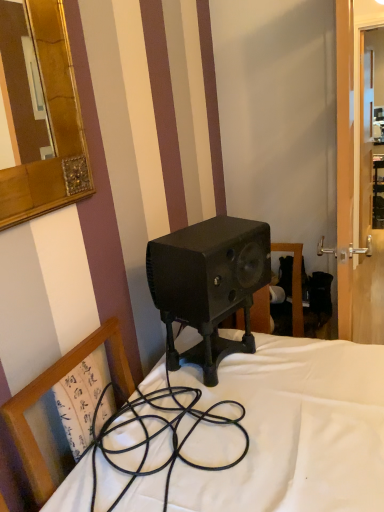
Question: Does matte black speaker at center come behind transparent glass door at right?

Choices:
 (A) yes
 (B) no

Answer: (B)

Question: Is matte black speaker at center positioned in front of transparent glass door at right?

Choices:
 (A) no
 (B) yes

Answer: (B)

Question: Can you confirm if matte black speaker at center is smaller than transparent glass door at right?

Choices:
 (A) yes
 (B) no

Answer: (A)

Question: Is matte black speaker at center next to transparent glass door at right?

Choices:
 (A) yes
 (B) no

Answer: (B)

Question: Can you confirm if matte black speaker at center is positioned to the right of transparent glass door at right?

Choices:
 (A) no
 (B) yes

Answer: (A)

Question: Is wooden chair at center in front of or behind matte black speaker at center in the image?

Choices:
 (A) front
 (B) behind

Answer: (A)

Question: Considering the positions of wooden chair at center and matte black speaker at center in the image, is wooden chair at center taller or shorter than matte black speaker at center?

Choices:
 (A) tall
 (B) short

Answer: (A)

Question: From a real-world perspective, is wooden chair at center physically located above or below matte black speaker at center?

Choices:
 (A) below
 (B) above

Answer: (A)

Question: Considering the positions of wooden chair at center and matte black speaker at center in the image, is wooden chair at center wider or thinner than matte black speaker at center?

Choices:
 (A) wide
 (B) thin

Answer: (A)

Question: Which is correct: matte black speaker at center is inside wooden chair at center, or outside of it?

Choices:
 (A) inside
 (B) outside

Answer: (B)

Question: Considering the positions of matte black speaker at center and wooden chair at center in the image, is matte black speaker at center wider or thinner than wooden chair at center?

Choices:
 (A) wide
 (B) thin

Answer: (B)

Question: Does point (175, 313) appear closer or farther from the camera than point (56, 377)?

Choices:
 (A) farther
 (B) closer

Answer: (A)

Question: Would you say matte black speaker at center is to the left or to the right of wooden chair at center in the picture?

Choices:
 (A) right
 (B) left

Answer: (A)

Question: In terms of size, does transparent glass door at right appear bigger or smaller than matte black speaker at center?

Choices:
 (A) small
 (B) big

Answer: (B)

Question: Is point tap(347, 275) positioned closer to the camera than point tap(157, 243)?

Choices:
 (A) closer
 (B) farther

Answer: (B)